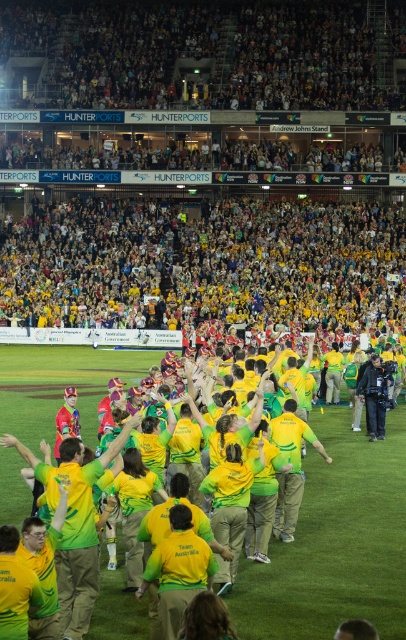
Is the position of green matte jersey at center more distant than that of dark blue jeans at lower right?

No, it is not.

Which is in front, point (287, 540) or point (380, 432)?

Point (287, 540) is more forward.

The width and height of the screenshot is (406, 640). What do you see at coordinates (291, 467) in the screenshot?
I see `green matte jersey at center` at bounding box center [291, 467].

Locate an element on the screen. This screenshot has height=640, width=406. green matte jersey at center is located at coordinates [291, 467].